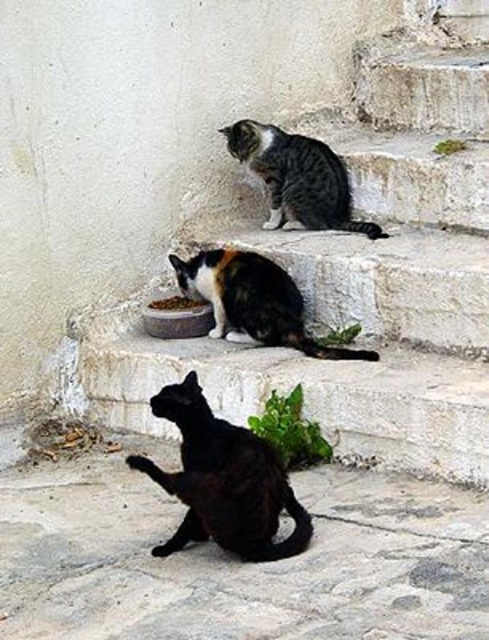
In the scene shown: Can you confirm if white stone stairs at center is bigger than striped fur cat at upper center?

Indeed, white stone stairs at center has a larger size compared to striped fur cat at upper center.

Between white stone stairs at center and striped fur cat at upper center, which one is positioned lower?

Positioned lower is striped fur cat at upper center.

You are a GUI agent. You are given a task and a screenshot of the screen. Output one action in this format:
    pyautogui.click(x=<x>, y=<y>)
    Task: Click on the white stone stairs at center
    This screenshot has height=640, width=489.
    Given the screenshot: What is the action you would take?
    pyautogui.click(x=357, y=268)

Does black matte cat at lower center appear on the right side of calico fur cat at center?

In fact, black matte cat at lower center is to the left of calico fur cat at center.

Between black matte cat at lower center and calico fur cat at center, which one has less height?

calico fur cat at center is shorter.

Image resolution: width=489 pixels, height=640 pixels. Identify the location of black matte cat at lower center. (223, 481).

Does calico fur cat at center have a greater height compared to striped fur cat at upper center?

No.

Based on the photo, is calico fur cat at center to the left of striped fur cat at upper center from the viewer's perspective?

Correct, you'll find calico fur cat at center to the left of striped fur cat at upper center.

The image size is (489, 640). Find the location of `calico fur cat at center`. calico fur cat at center is located at coordinates (252, 301).